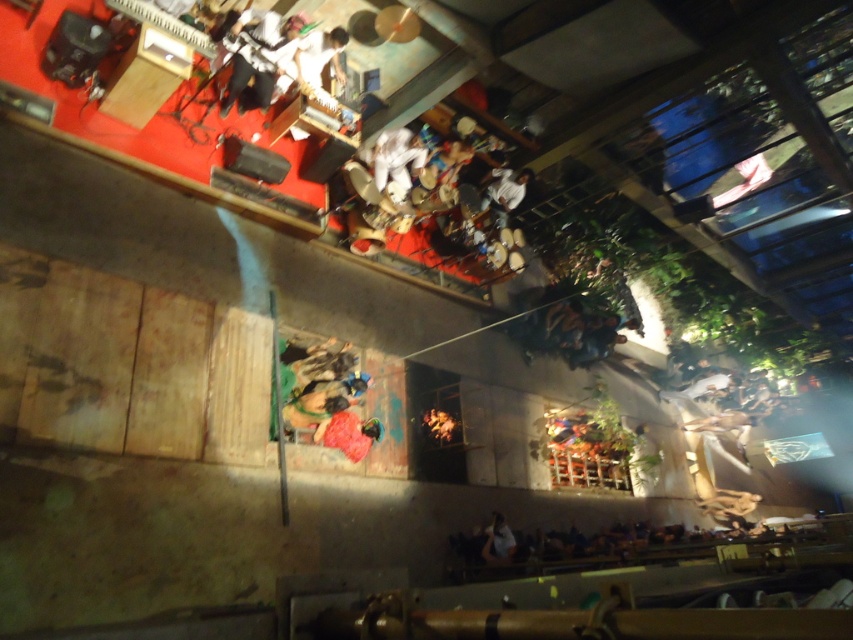
Can you confirm if white fabric guitar at upper center is wider than smooth brown leather jacket at lower right?

No, white fabric guitar at upper center is not wider than smooth brown leather jacket at lower right.

Does point (231, 97) come in front of point (746, 458)?

Yes.

Who is more forward, (247, 81) or (701, 420)?

Point (247, 81) is in front.

The width and height of the screenshot is (853, 640). I want to click on white fabric guitar at upper center, so click(259, 56).

Is wooden drum at upper center taller than velvet red dress at center?

Indeed, wooden drum at upper center has a greater height compared to velvet red dress at center.

Between point (300, 58) and point (361, 420), which one is positioned behind?

The point (361, 420) is behind.

The width and height of the screenshot is (853, 640). Find the location of `wooden drum at upper center`. wooden drum at upper center is located at coordinates (312, 60).

Does white cotton pants at center appear over white matte shirt at upper center?

Indeed, white cotton pants at center is positioned over white matte shirt at upper center.

Can you confirm if white cotton pants at center is smaller than white matte shirt at upper center?

Actually, white cotton pants at center might be larger than white matte shirt at upper center.

The width and height of the screenshot is (853, 640). What do you see at coordinates (399, 156) in the screenshot?
I see `white cotton pants at center` at bounding box center [399, 156].

You are a GUI agent. You are given a task and a screenshot of the screen. Output one action in this format:
    pyautogui.click(x=<x>, y=<y>)
    Task: Click on the white cotton pants at center
    The image size is (853, 640).
    Given the screenshot: What is the action you would take?
    pyautogui.click(x=399, y=156)